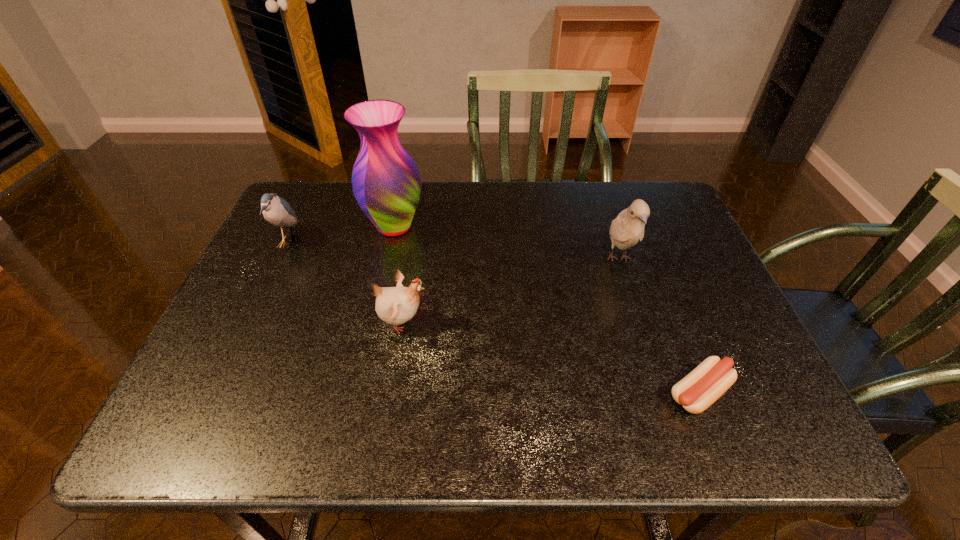
You are a GUI agent. You are given a task and a screenshot of the screen. Output one action in this format:
    pyautogui.click(x=<x>, y=<y>)
    Task: Click on the vacant area situated at the beak of the fourth shortest object
    The image size is (960, 540).
    Given the screenshot: What is the action you would take?
    pyautogui.click(x=676, y=434)

Locate an element on the screen. This screenshot has height=540, width=960. free space located at the tip of the leftmost bird's beak is located at coordinates (321, 242).

At what (x,y) coordinates should I click in order to perform the action: click on vacant space positioned at the beak of the nearest bird. Please return your answer as a coordinate pair (x, y). The width and height of the screenshot is (960, 540). Looking at the image, I should click on (573, 322).

Where is `vacant space located on the right of the nearest object`? vacant space located on the right of the nearest object is located at coordinates (779, 393).

At what (x,y) coordinates should I click in order to perform the action: click on vase that is positioned at the far edge. Please return your answer as a coordinate pair (x, y). The image size is (960, 540). Looking at the image, I should click on (386, 183).

Identify the location of bird that is at the far edge. The width and height of the screenshot is (960, 540). (277, 211).

Identify the location of object at the near edge. (698, 390).

Where is `object situated at the left edge`? Image resolution: width=960 pixels, height=540 pixels. object situated at the left edge is located at coordinates (277, 211).

This screenshot has width=960, height=540. Find the location of `object that is at the right edge`. object that is at the right edge is located at coordinates (698, 390).

The image size is (960, 540). In order to click on object that is at the far left corner in this screenshot , I will do `click(277, 211)`.